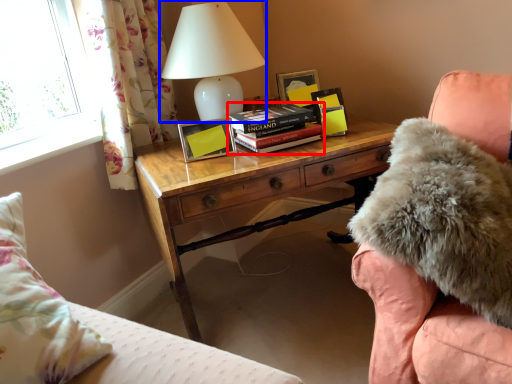
Question: Which object is further to the camera taking this photo, book (highlighted by a red box) or table lamp (highlighted by a blue box)?

Choices:
 (A) book
 (B) table lamp

Answer: (A)